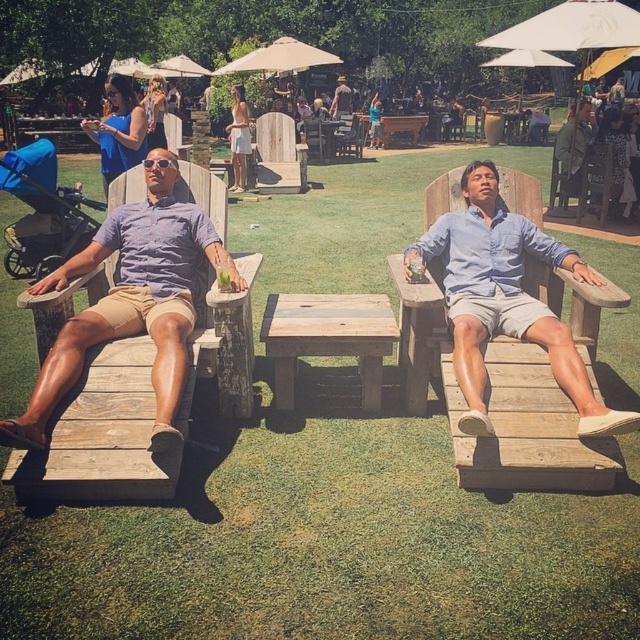
Question: Does wooden chair at right come behind matte gray shirt at center?

Choices:
 (A) no
 (B) yes

Answer: (A)

Question: Which point is farther to the camera?

Choices:
 (A) (20, 275)
 (B) (145, 154)
 (C) (563, 161)

Answer: (C)

Question: Is light blue shirt at center to the right of wooden chair at center from the viewer's perspective?

Choices:
 (A) yes
 (B) no

Answer: (A)

Question: Is matte purple shirt at left thinner than wooden chair at center?

Choices:
 (A) no
 (B) yes

Answer: (A)

Question: Which object is closer to the camera taking this photo?

Choices:
 (A) light blue shirt at center
 (B) matte purple shirt at left
 (C) white cotton dress at center
 (D) blue fabric stroller at left

Answer: (B)

Question: Which object is positioned farthest from the wooden bench at upper right?

Choices:
 (A) light blue shirt at center
 (B) matte gray shirt at center
 (C) matte purple shirt at left

Answer: (B)